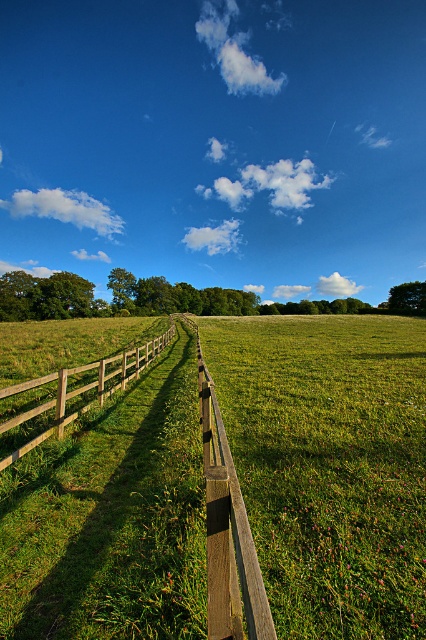
You are standing in the middle of the field and see the brown wooden rail at center and the wooden fence at left. Which one is shorter in height?

The brown wooden rail at center is not as tall as the wooden fence at left, so the brown wooden rail at center is shorter in height.

You are standing at the starting point in the rural landscape scene. There are two points marked in the image. The first point is at coordinates point (218, 557) and the second point is at point (22, 417). Which point is closer to you as you look towards the horizon?

Point (218, 557) is in front of point (22, 417), so it is closer to you.